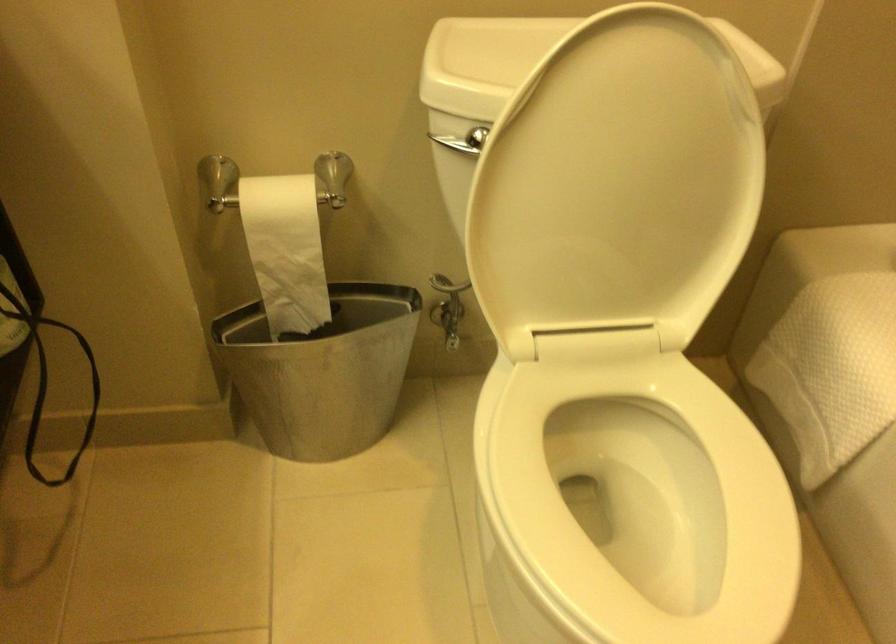
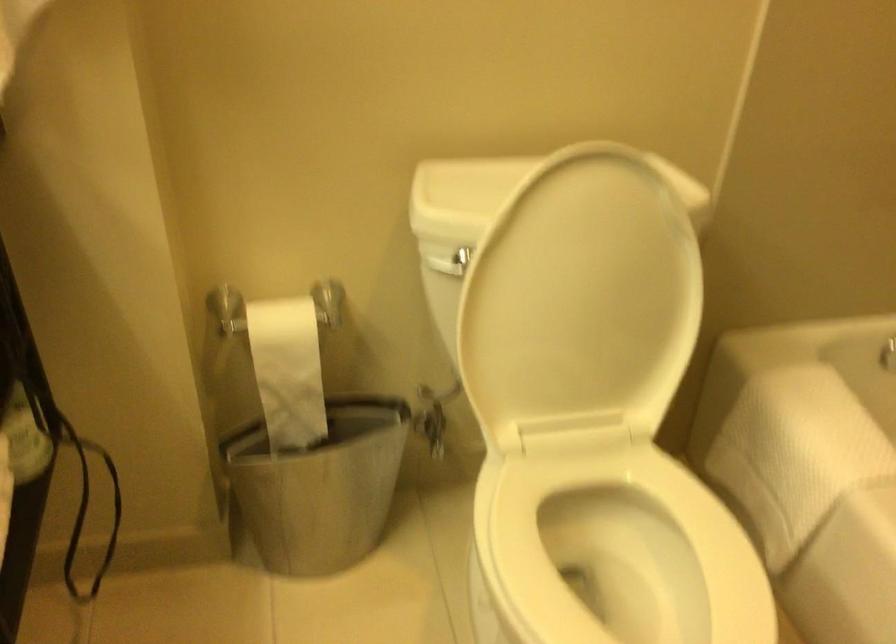
Question: I am providing you with two images of the same scene from different viewpoints. Which of the following objects are not visible in image2?

Choices:
 (A) silver flush handle
 (B) white toilet seat
 (C) white toilet paper
 (D) none of these

Answer: (D)